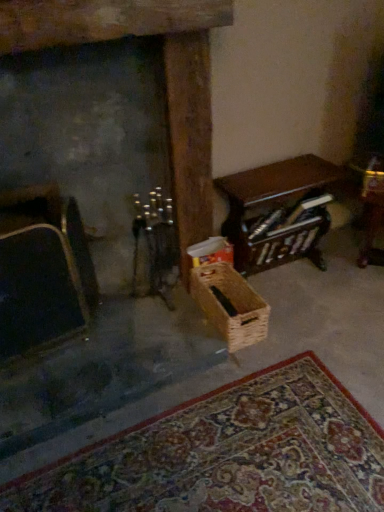
Question: Is velvet black armchair at left a part of woven brown basket at center?

Choices:
 (A) no
 (B) yes

Answer: (A)

Question: Does woven brown basket at center have a larger size compared to velvet black armchair at left?

Choices:
 (A) no
 (B) yes

Answer: (A)

Question: Is woven brown basket at center thinner than velvet black armchair at left?

Choices:
 (A) yes
 (B) no

Answer: (B)

Question: Is woven brown basket at center at the right side of velvet black armchair at left?

Choices:
 (A) yes
 (B) no

Answer: (A)

Question: From a real-world perspective, is woven brown basket at center beneath velvet black armchair at left?

Choices:
 (A) yes
 (B) no

Answer: (A)

Question: From the image's perspective, is wooden table at right positioned above or below velvet black armchair at left?

Choices:
 (A) below
 (B) above

Answer: (B)

Question: From a real-world perspective, is wooden table at right positioned above or below velvet black armchair at left?

Choices:
 (A) above
 (B) below

Answer: (B)

Question: Is wooden table at right wider or thinner than velvet black armchair at left?

Choices:
 (A) wide
 (B) thin

Answer: (A)

Question: Considering the relative positions of wooden table at right and velvet black armchair at left in the image provided, is wooden table at right to the left or to the right of velvet black armchair at left?

Choices:
 (A) left
 (B) right

Answer: (B)

Question: From the image's perspective, is velvet black armchair at left positioned above or below woven brown basket at center?

Choices:
 (A) above
 (B) below

Answer: (A)

Question: Considering their positions, is velvet black armchair at left located in front of or behind woven brown basket at center?

Choices:
 (A) behind
 (B) front

Answer: (B)

Question: Considering the positions of velvet black armchair at left and woven brown basket at center in the image, is velvet black armchair at left taller or shorter than woven brown basket at center?

Choices:
 (A) tall
 (B) short

Answer: (A)

Question: Is velvet black armchair at left inside or outside of woven brown basket at center?

Choices:
 (A) inside
 (B) outside

Answer: (B)

Question: Considering the positions of woven brown basket at center and wooden table at right in the image, is woven brown basket at center taller or shorter than wooden table at right?

Choices:
 (A) short
 (B) tall

Answer: (A)

Question: Is woven brown basket at center wider or thinner than wooden table at right?

Choices:
 (A) thin
 (B) wide

Answer: (B)